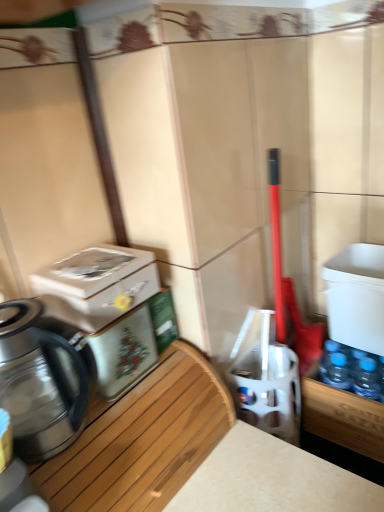
Question: Considering the relative sizes of woodenmaterial/texture at left and shiny metallic kettle at left in the image provided, is woodenmaterial/texture at left thinner than shiny metallic kettle at left?

Choices:
 (A) no
 (B) yes

Answer: (A)

Question: Does woodenmaterial/texture at left have a larger size compared to shiny metallic kettle at left?

Choices:
 (A) yes
 (B) no

Answer: (A)

Question: Is woodenmaterial/texture at left not within shiny metallic kettle at left?

Choices:
 (A) no
 (B) yes

Answer: (B)

Question: Can shiny metallic kettle at left be found inside woodenmaterial/texture at left?

Choices:
 (A) yes
 (B) no

Answer: (B)

Question: Can you confirm if woodenmaterial/texture at left is positioned to the right of shiny metallic kettle at left?

Choices:
 (A) yes
 (B) no

Answer: (A)

Question: Based on their sizes in the image, would you say white glossy water cooler at center, which is the 2th water cooler from right to left, is bigger or smaller than shiny metallic kettle at left?

Choices:
 (A) big
 (B) small

Answer: (B)

Question: From the image's perspective, is white glossy water cooler at center, which is the 2th water cooler from right to left, above or below shiny metallic kettle at left?

Choices:
 (A) above
 (B) below

Answer: (B)

Question: In the image, is white glossy water cooler at center, placed as the 2th water cooler when sorted from left to right, on the left side or the right side of shiny metallic kettle at left?

Choices:
 (A) right
 (B) left

Answer: (A)

Question: Do you think white glossy water cooler at center, which is the 2th water cooler from right to left, is within shiny metallic kettle at left, or outside of it?

Choices:
 (A) inside
 (B) outside

Answer: (B)

Question: Considering the positions of point (139, 286) and point (382, 265), is point (139, 286) closer or farther from the camera than point (382, 265)?

Choices:
 (A) farther
 (B) closer

Answer: (B)

Question: From the image's perspective, is metallic silver water cooler at left, the 3th water cooler from the right, positioned above or below white plastic water cooler at right, the first water cooler positioned from the right?

Choices:
 (A) above
 (B) below

Answer: (B)

Question: Is metallic silver water cooler at left, the 3th water cooler from the right, situated inside white plastic water cooler at right, acting as the 3th water cooler starting from the left, or outside?

Choices:
 (A) inside
 (B) outside

Answer: (B)

Question: From their relative heights in the image, would you say metallic silver water cooler at left, the 3th water cooler from the right, is taller or shorter than white plastic water cooler at right, the first water cooler positioned from the right?

Choices:
 (A) tall
 (B) short

Answer: (B)

Question: Is white plastic water cooler at right, acting as the 3th water cooler starting from the left, situated inside shiny metallic kettle at left or outside?

Choices:
 (A) inside
 (B) outside

Answer: (B)

Question: From a real-world perspective, relative to shiny metallic kettle at left, is white plastic water cooler at right, acting as the 3th water cooler starting from the left, vertically above or below?

Choices:
 (A) below
 (B) above

Answer: (A)